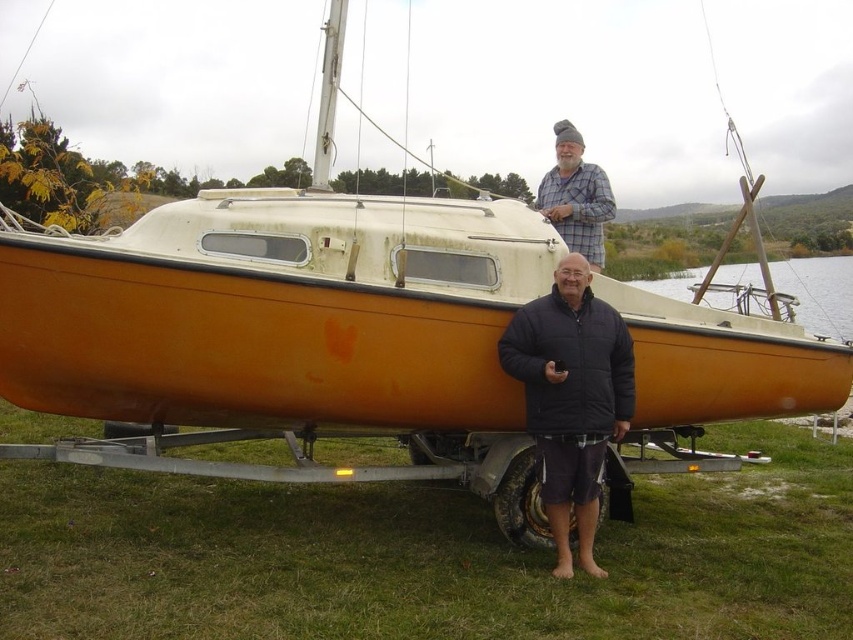
Between black fuzzy jacket at center and plaid fabric shirt at upper center, which one is positioned lower?

black fuzzy jacket at center

Who is higher up, black fuzzy jacket at center or plaid fabric shirt at upper center?

Positioned higher is plaid fabric shirt at upper center.

Does point (549, 508) come behind point (602, 179)?

That is False.

Locate an element on the screen. black fuzzy jacket at center is located at coordinates (572, 397).